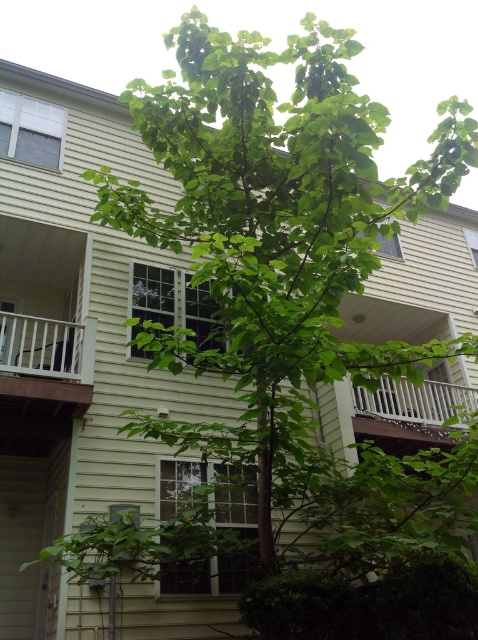
Question: Among these objects, which one is nearest to the camera?

Choices:
 (A) white wooden railing at lower left
 (B) white wooden railing at lower right

Answer: (A)

Question: Is white wooden railing at lower left positioned at the back of white wooden railing at lower right?

Choices:
 (A) no
 (B) yes

Answer: (A)

Question: Does white wooden railing at lower left appear under white wooden railing at lower right?

Choices:
 (A) yes
 (B) no

Answer: (B)

Question: From the image, what is the correct spatial relationship of white wooden railing at lower left in relation to white wooden railing at lower right?

Choices:
 (A) above
 (B) below

Answer: (A)